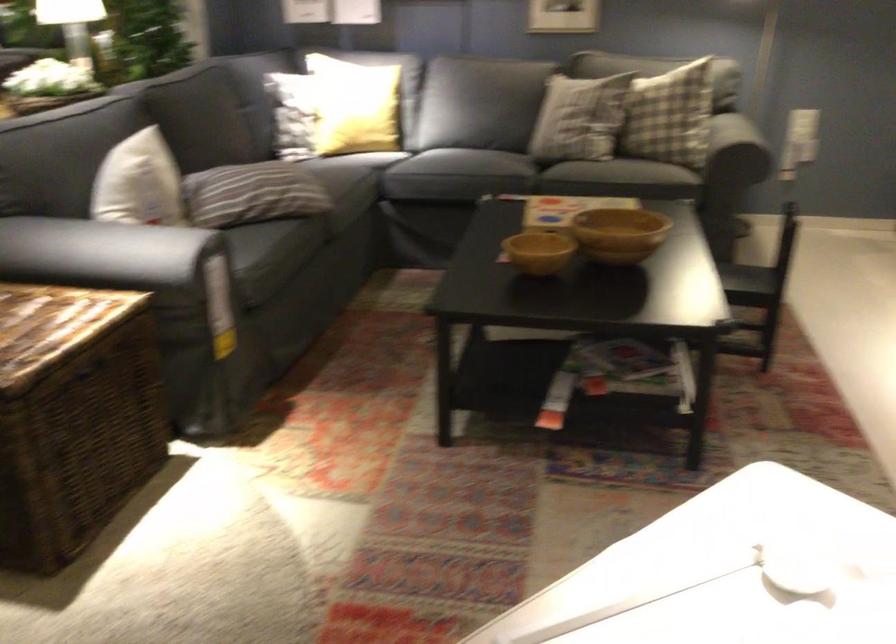
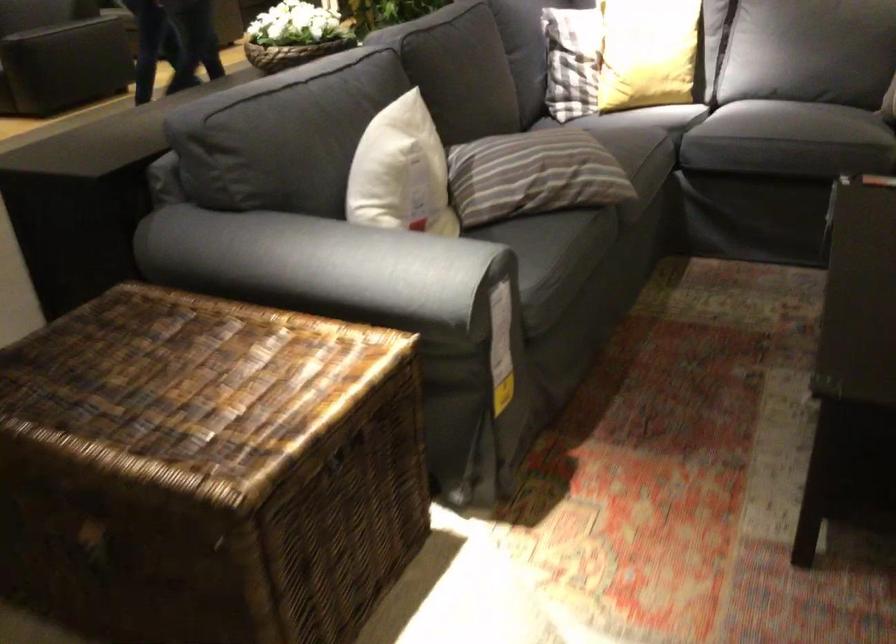
Where in the second image is the point corresponding to point 291,114 from the first image?

(572, 61)